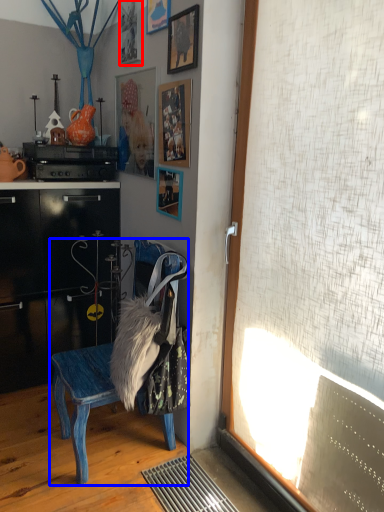
Question: Which object appears farthest to the camera in this image, picture frame (highlighted by a red box) or chair (highlighted by a blue box)?

Choices:
 (A) picture frame
 (B) chair

Answer: (A)